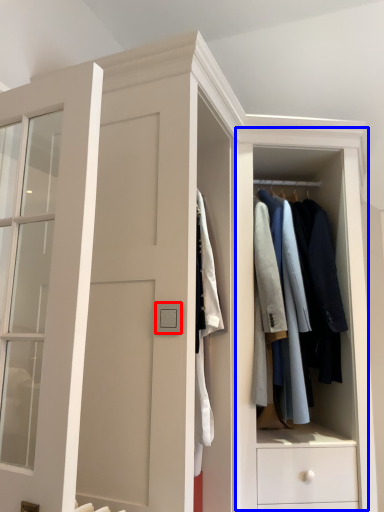
Question: Which point is closer to the camera, light switch (highlighted by a red box) or dresser (highlighted by a blue box)?

Choices:
 (A) light switch
 (B) dresser

Answer: (A)